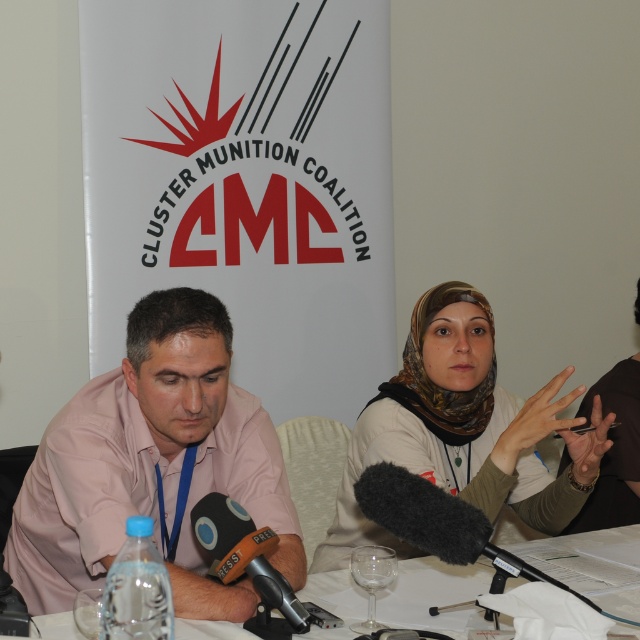
You are attending a press conference and notice the pink shirt at left. Can you determine its exact coordinates in the image?

The pink shirt at left is located at point (152, 465).

You are attending a press conference and see the pink shirt at left and the white paper at center. Which object is closer to you?

The pink shirt at left is closer to you because the white paper at center is behind it.

You are attending a press conference and need to place a document on the table. The organizers have specified that the document must be placed to the left of the microphone. Given the current setup with the white paper at center and the black foam microphone at center, can you place the document in the correct position?

The white paper at center is currently to the right of the black foam microphone at center. To comply with the requirement, you should place the document to the left of the microphone instead of its current position.